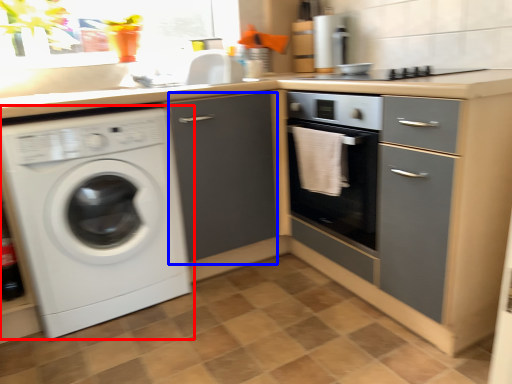
Question: Which object appears closest to the camera in this image, washing machine (highlighted by a red box) or file cabinet (highlighted by a blue box)?

Choices:
 (A) washing machine
 (B) file cabinet

Answer: (A)